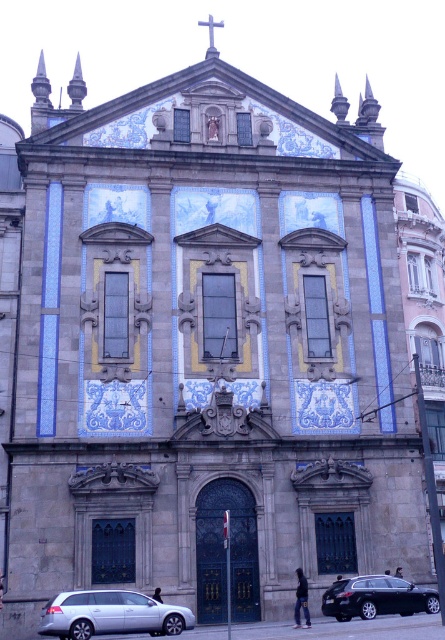
You are a visitor arriving at the historic church and see the silver metallic car at lower left and the shiny black sedan at lower center parked near the entrance. Which vehicle takes up more parking space?

The shiny black sedan at lower center takes up more parking space than the silver metallic car at lower left because the silver metallic car at lower left occupies less space than shiny black sedan at lower center.

You are a photographer planning to take a picture of the historic building facade. You want to ensure that both the silver metallic car at lower left and the shiny black sedan at lower center are visible in the frame. Which car should you position closer to the camera to include both in the shot without cropping?

The silver metallic car at lower left has a lesser height compared to the shiny black sedan at lower center. To include both in the frame without cropping, position the silver metallic car at lower left closer to the camera so its smaller size balances with the taller shiny black sedan at lower center.